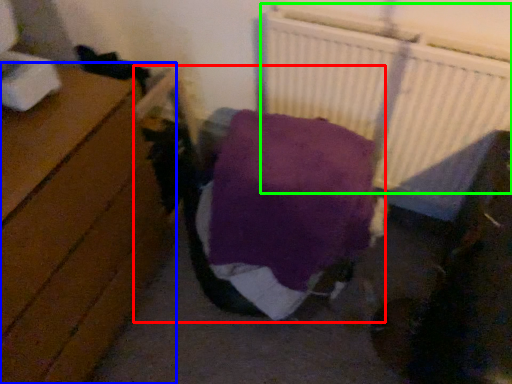
Question: Considering the real-world distances, which object is closest to bed (highlighted by a red box)? furniture (highlighted by a blue box) or radiator (highlighted by a green box).

Choices:
 (A) furniture
 (B) radiator

Answer: (A)